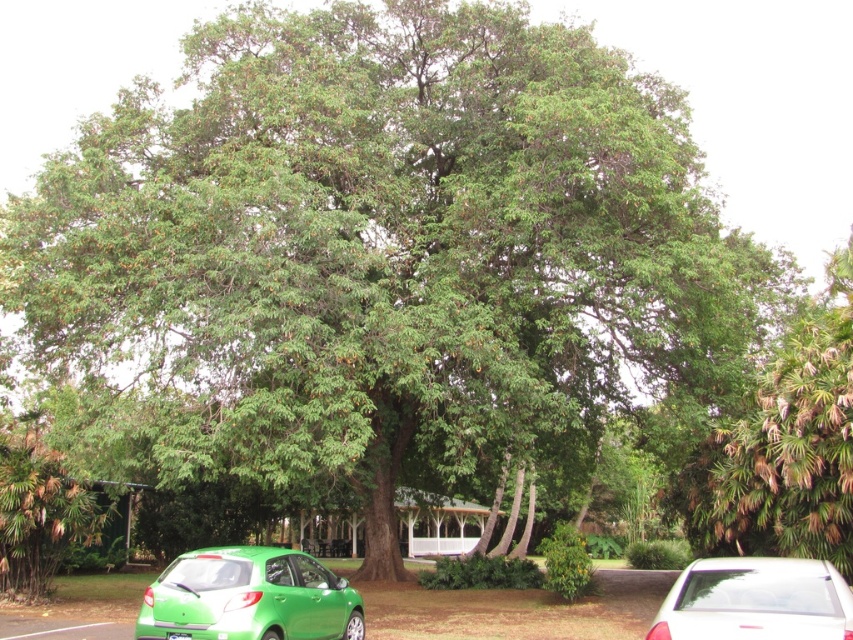
Between white glossy sedan at lower right and green leafy tree at lower left, which one is positioned lower?

green leafy tree at lower left is lower down.

Does white glossy sedan at lower right appear on the right side of green leafy tree at lower left?

Indeed, white glossy sedan at lower right is positioned on the right side of green leafy tree at lower left.

Does point (793, 621) come farther from viewer compared to point (18, 582)?

No.

Identify the location of white glossy sedan at lower right. The image size is (853, 640). (755, 600).

Who is positioned more to the left, green matte hatchback at lower left or white glossy sedan at lower right?

Positioned to the left is green matte hatchback at lower left.

This screenshot has height=640, width=853. Describe the element at coordinates (248, 596) in the screenshot. I see `green matte hatchback at lower left` at that location.

The height and width of the screenshot is (640, 853). I want to click on green matte hatchback at lower left, so click(x=248, y=596).

Does point (252, 620) lie in front of point (189, 637)?

No.

Is green matte hatchback at lower left taller than green plastic license plate at lower center?

Yes, green matte hatchback at lower left is taller than green plastic license plate at lower center.

Find the location of `green matte hatchback at lower left`. green matte hatchback at lower left is located at coordinates (248, 596).